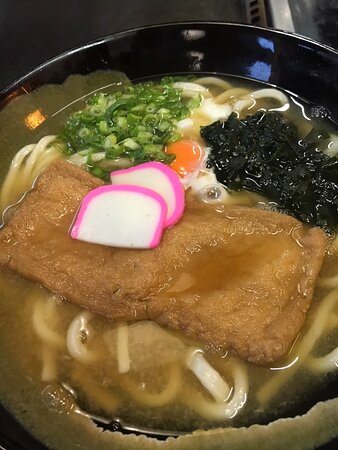
Where is `pot`? pot is located at coordinates (145, 42).